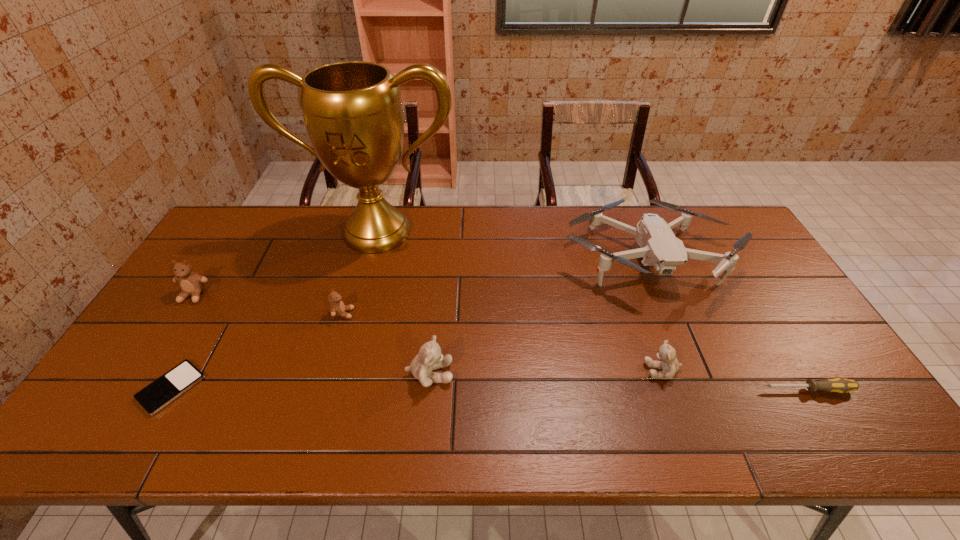
At what (x,y) coordinates should I click in order to perform the action: click on vacant space that's between the second teddy bear from right to left and the gold trophy cup. Please return your answer as a coordinate pair (x, y). Looking at the image, I should click on (403, 303).

You are a GUI agent. You are given a task and a screenshot of the screen. Output one action in this format:
    pyautogui.click(x=<x>, y=<y>)
    Task: Click on the free space between the leftmost teddy bear and the tallest object
    
    Given the screenshot: What is the action you would take?
    pyautogui.click(x=285, y=264)

Identify which object is located as the seventh nearest to the drone. Please provide its 2D coordinates. Your answer should be formatted as a tuple, i.e. [(x, y)], where the tuple contains the x and y coordinates of a point satisfying the conditions above.

[(191, 284)]

In order to click on object that ranks as the fifth closest to the shortest object in this screenshot , I will do `click(660, 248)`.

Locate which teddy bear is the closest to the iPod. Please provide its 2D coordinates. Your answer should be formatted as a tuple, i.e. [(x, y)], where the tuple contains the x and y coordinates of a point satisfying the conditions above.

[(191, 284)]

Locate which teddy bear is the third closest to the tallest object. Please provide its 2D coordinates. Your answer should be formatted as a tuple, i.e. [(x, y)], where the tuple contains the x and y coordinates of a point satisfying the conditions above.

[(430, 357)]

Image resolution: width=960 pixels, height=540 pixels. In order to click on free space that satisfies the following two spatial constraints: 1. with a camera at the front of the drone; 2. on the face of the smaller gray teddy bear in this screenshot , I will do `click(690, 370)`.